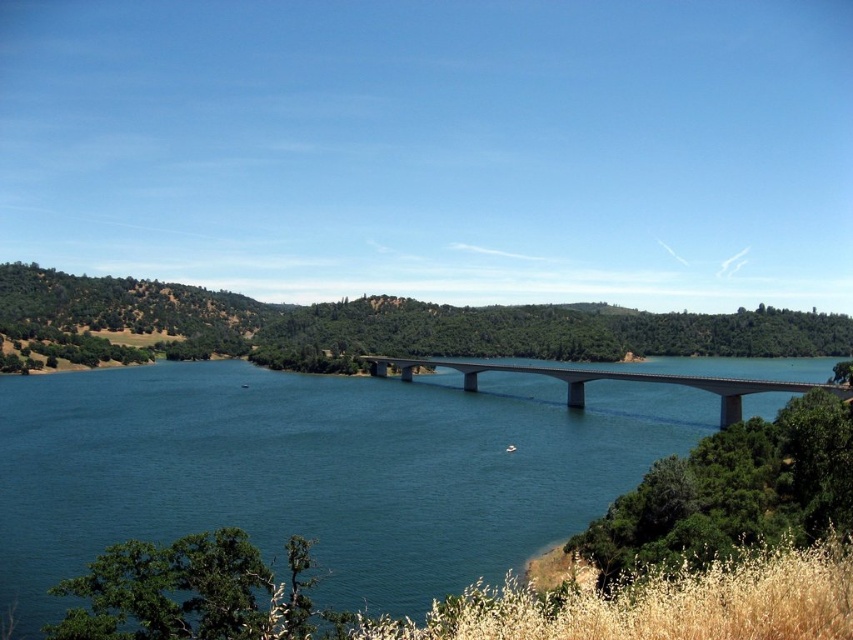
You are standing on the concrete bridge at center and looking down. Can you see the blue smooth water at center below you?

Yes, because the blue smooth water at center is below the concrete bridge at center, so you can see it when looking down.

You are a photographer planning to capture the entire view of the green leafy hillside at center and the concrete bridge at center in one shot. Based on their sizes, which object should you focus on to ensure both are visible in the frame?

The green leafy hillside at center has a larger width than the concrete bridge at center, so you should focus on the green leafy hillside at center to ensure both are visible in the frame.